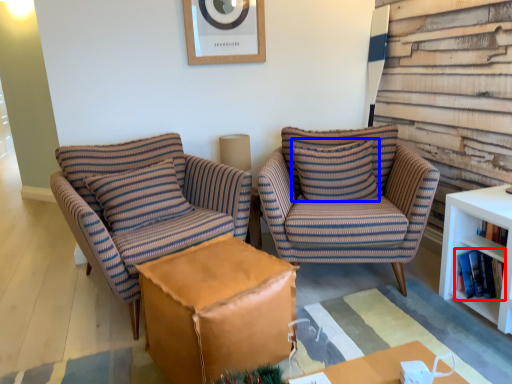
Question: Among these objects, which one is nearest to the camera, book (highlighted by a red box) or pillow (highlighted by a blue box)?

Choices:
 (A) book
 (B) pillow

Answer: (A)